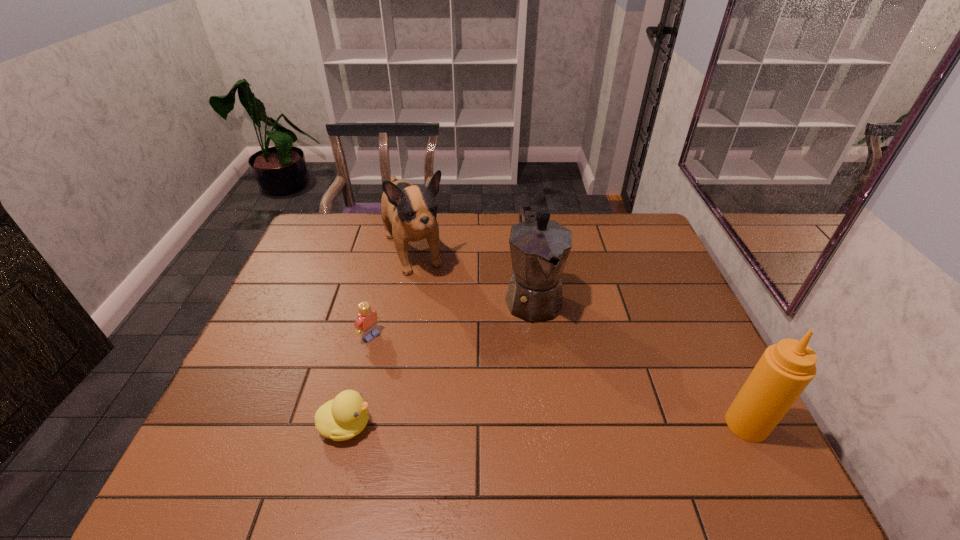
Find the location of a particular element. This screenshot has height=540, width=960. empty space between the puppy and the second object from right to left is located at coordinates (473, 275).

The height and width of the screenshot is (540, 960). Find the location of `empty space between the puppy and the Lego`. empty space between the puppy and the Lego is located at coordinates (392, 294).

This screenshot has width=960, height=540. I want to click on free area in between the duckling and the second object from right to left, so click(x=440, y=362).

This screenshot has height=540, width=960. Identify the location of free spot between the fourth object from left to right and the puppy. (473, 275).

Locate an element on the screen. The image size is (960, 540). empty location between the rightmost object and the duckling is located at coordinates [x=546, y=425].

Locate an element on the screen. This screenshot has height=540, width=960. free point between the puppy and the coffeepot is located at coordinates click(473, 275).

Find the location of `free space between the condiment and the fourth object from left to right`. free space between the condiment and the fourth object from left to right is located at coordinates (639, 361).

Identify which object is the closest to the condiment. Please provide its 2D coordinates. Your answer should be formatted as a tuple, i.e. [(x, y)], where the tuple contains the x and y coordinates of a point satisfying the conditions above.

[(539, 247)]

The image size is (960, 540). I want to click on object that is the closest to the shortest object, so click(366, 324).

Find the location of `free spot that satisfies the following two spatial constraints: 1. on the front side of the coffeepot; 2. on the left side of the puppy`. free spot that satisfies the following two spatial constraints: 1. on the front side of the coffeepot; 2. on the left side of the puppy is located at coordinates (405, 298).